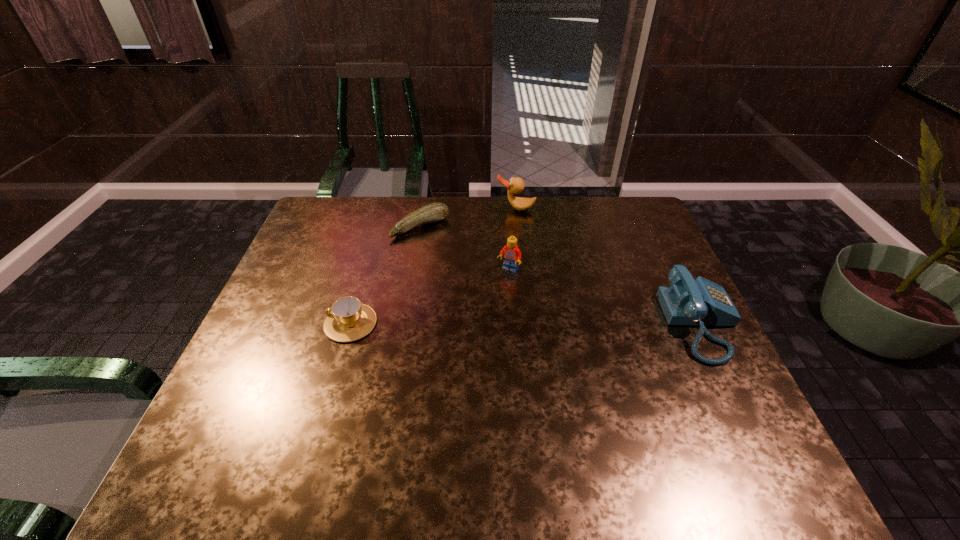
Locate an element on the screen. vacant space at the far edge of the desktop is located at coordinates (434, 198).

The width and height of the screenshot is (960, 540). What are the coordinates of `vacant area at the near edge` in the screenshot? It's located at (626, 409).

Where is `vacant space at the left edge`? This screenshot has height=540, width=960. vacant space at the left edge is located at coordinates (297, 335).

This screenshot has height=540, width=960. What are the coordinates of `free spot at the right edge of the desktop` in the screenshot? It's located at (680, 363).

Where is `vacant space at the far left corner of the desktop`? The height and width of the screenshot is (540, 960). vacant space at the far left corner of the desktop is located at coordinates (355, 197).

Identify the location of free space at the far right corner of the desktop. (631, 208).

In the image, there is a desktop. Where is `free space at the near right corner`? The width and height of the screenshot is (960, 540). free space at the near right corner is located at coordinates (714, 424).

Find the location of a particular element. Image resolution: width=960 pixels, height=540 pixels. free space between the duck and the cup is located at coordinates (433, 266).

You are a GUI agent. You are given a task and a screenshot of the screen. Output one action in this format:
    pyautogui.click(x=<x>, y=<y>)
    Task: Click on the vacant point located between the third nearest object and the zucchini
    
    Given the screenshot: What is the action you would take?
    pyautogui.click(x=465, y=248)

Image resolution: width=960 pixels, height=540 pixels. Find the location of `empty space between the cup and the telephone`. empty space between the cup and the telephone is located at coordinates (526, 323).